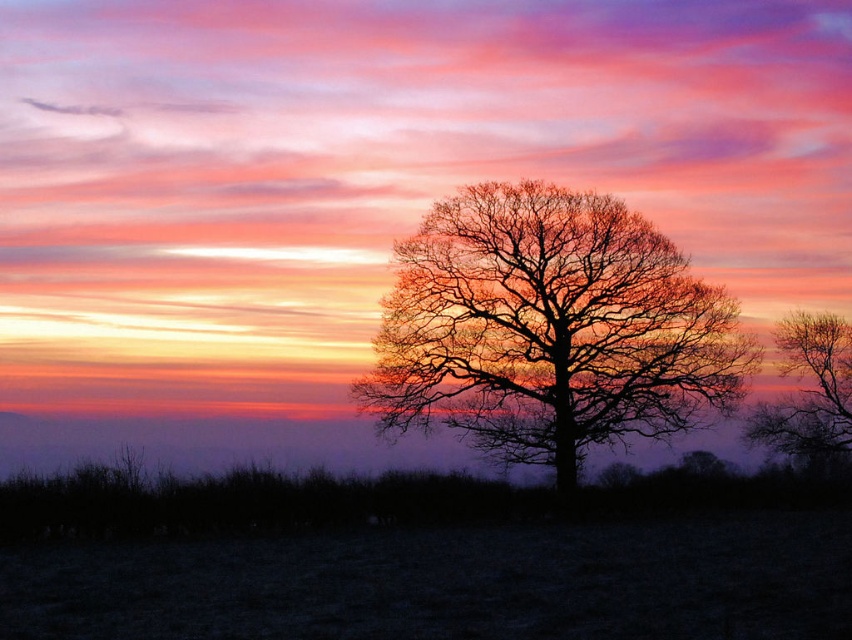
Question: Which point appears farthest from the camera in this image?

Choices:
 (A) (833, 360)
 (B) (560, 355)

Answer: (A)

Question: Does bare branches at center appear over silhouette bare tree at center?

Choices:
 (A) no
 (B) yes

Answer: (B)

Question: Which point is farther to the camera?

Choices:
 (A) (845, 349)
 (B) (695, 368)

Answer: (A)

Question: Does bare branches at center have a larger size compared to silhouette bare tree at center?

Choices:
 (A) yes
 (B) no

Answer: (A)

Question: From the image, what is the correct spatial relationship of bare branches at center in relation to silhouette bare tree at center?

Choices:
 (A) below
 (B) above

Answer: (B)

Question: Which of the following is the farthest from the observer?

Choices:
 (A) bare branches at center
 (B) silhouette bare tree at center

Answer: (B)